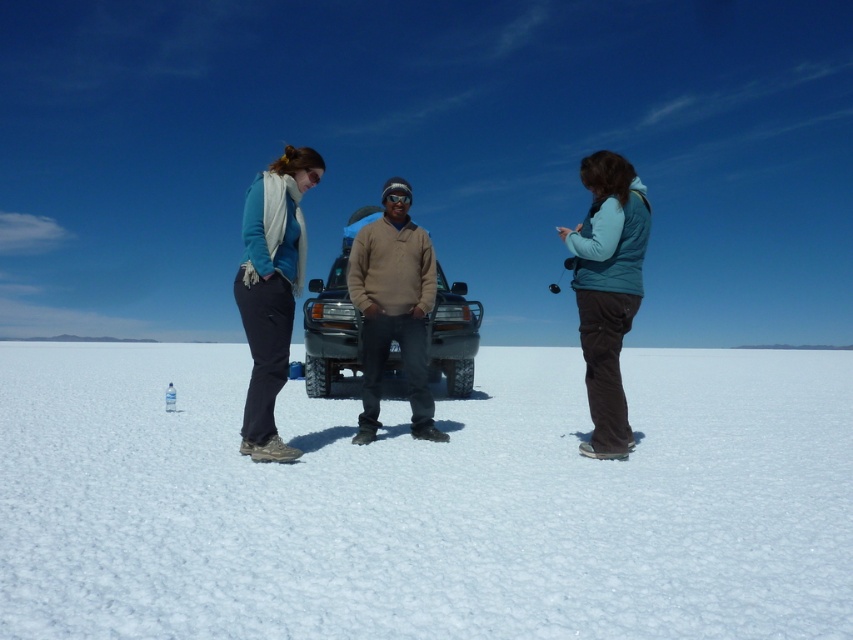
You are planning to take a photo of the matte blue sweater at center from a specific location. To ensure the sweater is in the frame, where should you position yourself relative to the sweater?

The matte blue sweater at center is located at point (271, 289), so you should position yourself directly in front of it to capture it in the frame.

You are standing on the salt flat and want to take a photo of the matte blue sweater at center. If your camera has a maximum focus range of 15 feet, will you be able to capture it clearly?

The matte blue sweater at center is 15.02 feet away from the viewer. Since the camera can only focus up to 15 feet, it is slightly out of range, so the photo may not be clear.

You are a photographer trying to capture a group photo of the teal fleece vest at center and the matte blue sweater at center. Since they are standing close to each other, you want to ensure both are in focus. Which person should you focus on to make sure both are sharp?

You should focus on the teal fleece vest at center because it is closer to the camera than the matte blue sweater at center, ensuring both are in focus.